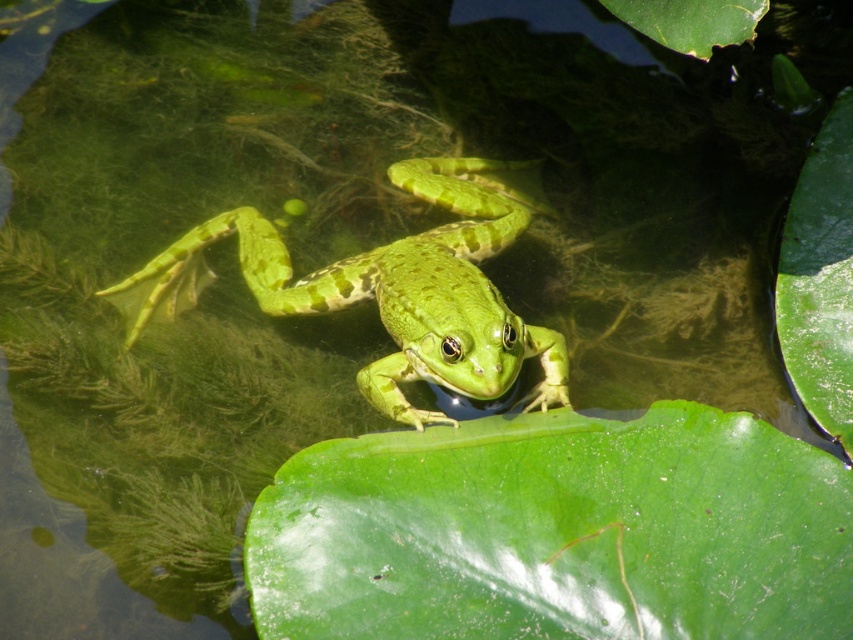
Question: Does green glossy leaf at center have a larger size compared to green matte leaf at upper center?

Choices:
 (A) yes
 (B) no

Answer: (A)

Question: Among these points, which one is farthest from the camera?

Choices:
 (A) (666, 45)
 (B) (126, 289)
 (C) (842, 563)

Answer: (B)

Question: Which point is farther to the camera?

Choices:
 (A) (698, 38)
 (B) (563, 461)

Answer: (A)

Question: Is green glossy leaf at center to the left of green matte leaf at upper center from the viewer's perspective?

Choices:
 (A) no
 (B) yes

Answer: (B)

Question: Can you confirm if green matte/skinny frog at center is positioned above green matte leaf at upper center?

Choices:
 (A) no
 (B) yes

Answer: (A)

Question: Which point is farther to the camera?

Choices:
 (A) (670, 6)
 (B) (589, 493)
 (C) (525, 225)

Answer: (C)